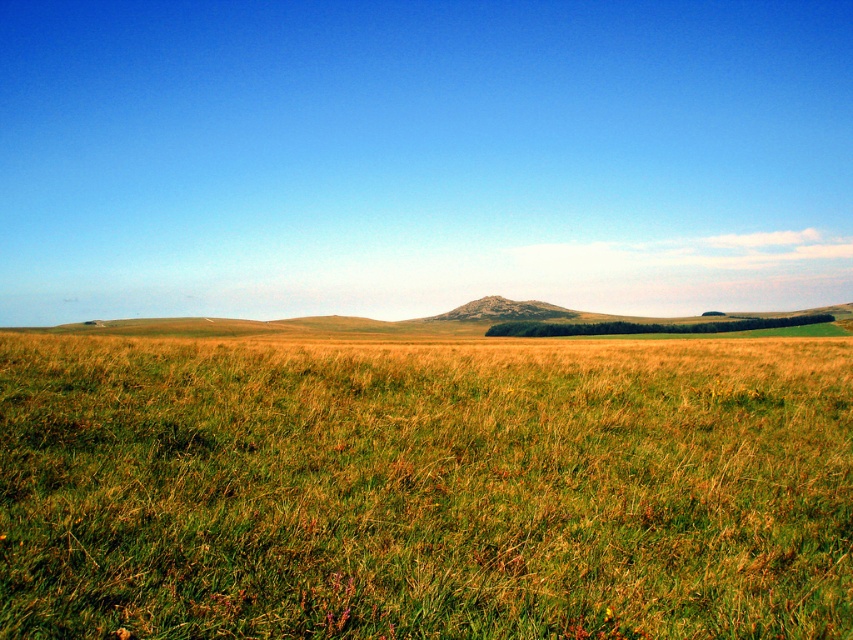
You are standing in the middle of the green grassy field at center and want to walk towards the rustic granite mountain at center. Which direction should you head to reach the mountain?

The green grassy field at center is positioned on the left side of rustic granite mountain at center, so to reach the mountain, you should head to the right.

Looking at this image, you are standing at the edge of the green grassy field at center and want to walk to the rustic granite mountain at center. Which direction should you go to reach the mountain?

The rustic granite mountain at center is located at the horizon line, so you should walk forward towards the center to reach it.